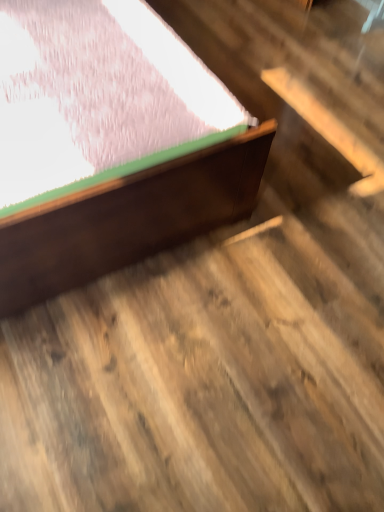
Locate an element on the screen. vacant area to the right of wooden bed at upper left is located at coordinates (307, 152).